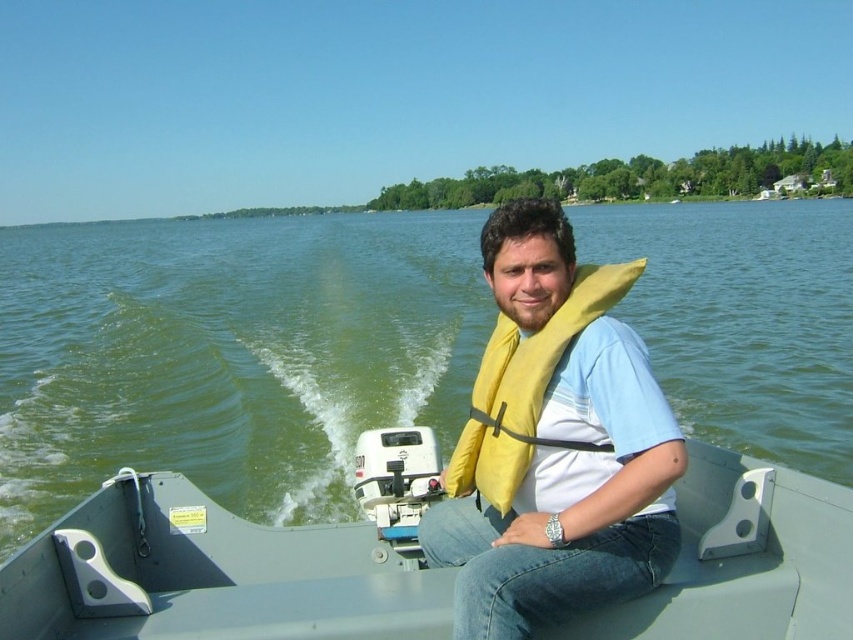
Which of these two, green water at center or yellow fabric life jacket at center, stands shorter?

yellow fabric life jacket at center

Can you confirm if green water at center is positioned to the left of yellow fabric life jacket at center?

Incorrect, green water at center is not on the left side of yellow fabric life jacket at center.

This screenshot has height=640, width=853. Describe the element at coordinates (229, 355) in the screenshot. I see `green water at center` at that location.

I want to click on green water at center, so click(x=229, y=355).

How much distance is there between green water at center and metallic gray boat at center?

The distance of green water at center from metallic gray boat at center is 168.09 feet.

Who is taller, green water at center or metallic gray boat at center?

green water at center

Which is in front, point (178, 339) or point (550, 637)?

Point (550, 637) is in front.

Find the location of `green water at center`. green water at center is located at coordinates (229, 355).

Can you confirm if metallic gray boat at center is wider than yellow fabric life jacket at center?

Indeed, metallic gray boat at center has a greater width compared to yellow fabric life jacket at center.

Identify the location of metallic gray boat at center. (234, 563).

Between point (827, 598) and point (495, 388), which one is positioned behind?

The point (495, 388) is behind.

You are a GUI agent. You are given a task and a screenshot of the screen. Output one action in this format:
    pyautogui.click(x=<x>, y=<y>)
    Task: Click on the metallic gray boat at center
    The width and height of the screenshot is (853, 640).
    Given the screenshot: What is the action you would take?
    pyautogui.click(x=234, y=563)